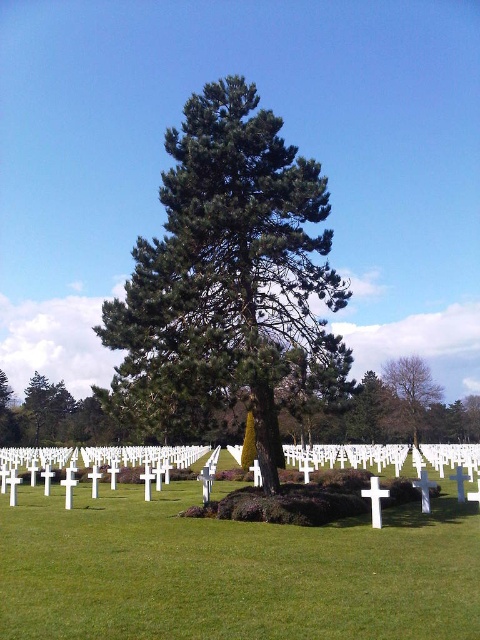
You are a landscape architect designing a memorial garden. You need to place a new statue between the green textured tree at center and the smooth brown tree at right. Which tree should the statue be closer to if you want it to be near the thinner tree?

The green textured tree at center is thinner than the smooth brown tree at right, so the statue should be placed closer to the green textured tree at center.

You are a visitor at the cemetery and want to place a wreath exactly halfway between the green textured tree at center and the smooth brown tree at right. Based on their positions, which tree will the wreath be closer to?

The wreath will be closer to the green textured tree at center because it is positioned to the left of the smooth brown tree at right, making the distance from the center tree to the midpoint shorter than from the right tree to the midpoint.